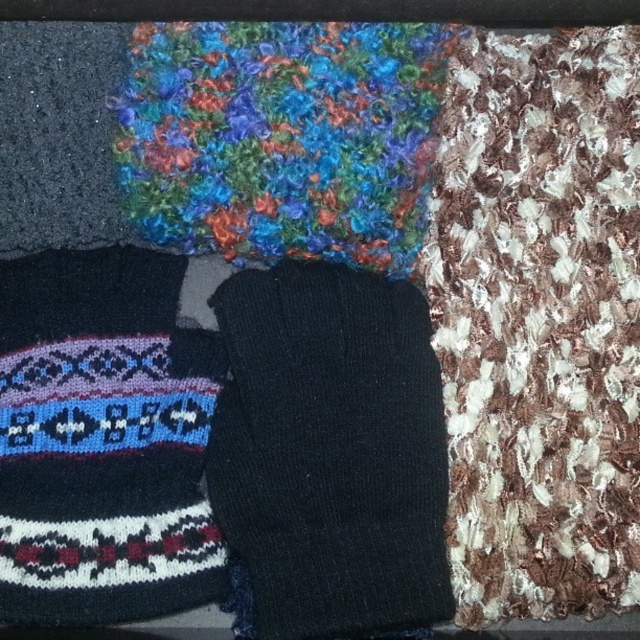
Does black knitted sock at center appear on the left side of knitted woolen sock at lower left?

No, black knitted sock at center is not to the left of knitted woolen sock at lower left.

Which is more to the left, black knitted sock at center or knitted woolen sock at lower left?

Positioned to the left is knitted woolen sock at lower left.

You are a GUI agent. You are given a task and a screenshot of the screen. Output one action in this format:
    pyautogui.click(x=<x>, y=<y>)
    Task: Click on the black knitted sock at center
    
    Given the screenshot: What is the action you would take?
    pyautogui.click(x=330, y=451)